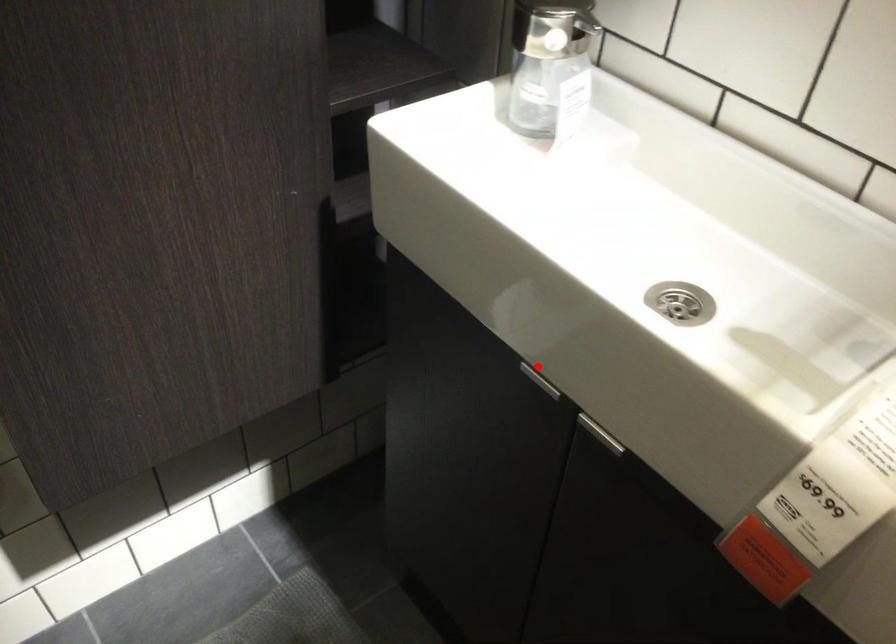
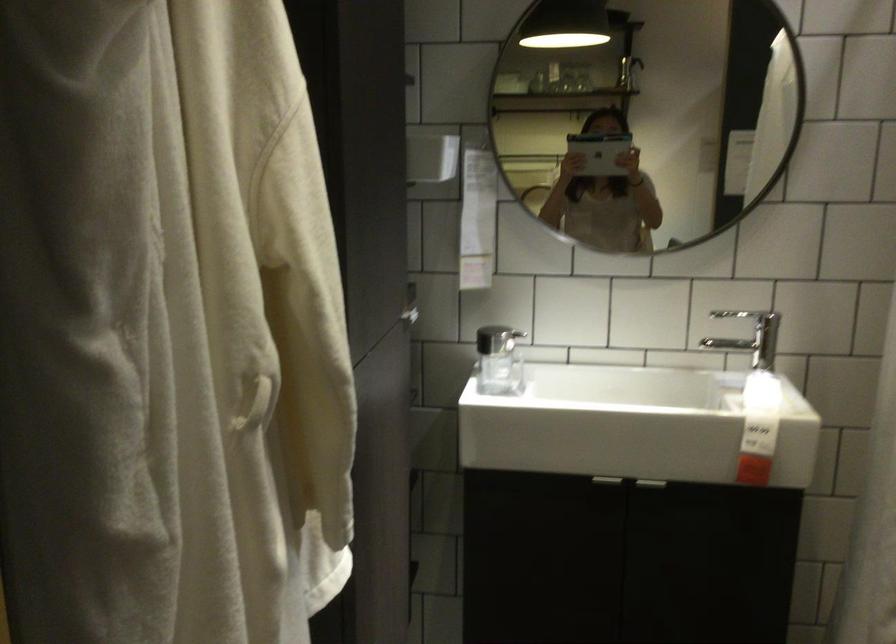
Find the pixel in the second image that matches the highlighted location in the first image.

(607, 480)